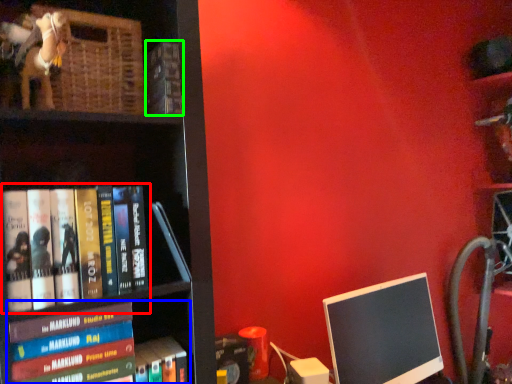
Question: Which object is positioned closest to book (highlighted by a red box)? Select from book (highlighted by a blue box) and book (highlighted by a green box).

Choices:
 (A) book
 (B) book

Answer: (A)